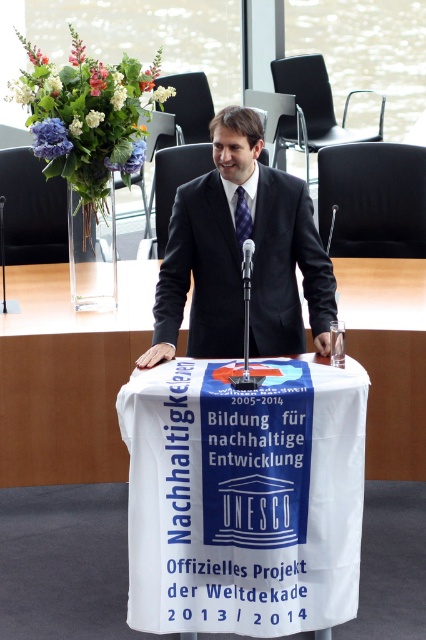
Question: Can you confirm if white cloth at center is wider than white cloth-covered table at center?

Choices:
 (A) yes
 (B) no

Answer: (B)

Question: Which object is the closest to the black plastic microphone at center?

Choices:
 (A) black suit at center
 (B) white cloth at center

Answer: (A)

Question: Based on their relative distances, which object is farther from the blue checkered tie at center?

Choices:
 (A) black suit at center
 (B) metallic silver microphone at center

Answer: (B)

Question: Does white cloth-covered table at center have a smaller size compared to blue checkered tie at center?

Choices:
 (A) no
 (B) yes

Answer: (A)

Question: Which of the following is the farthest from the observer?

Choices:
 (A) black suit at center
 (B) white cloth at center
 (C) metallic silver microphone at center
 (D) black plastic microphone at center

Answer: (D)

Question: Can you confirm if black suit at center is positioned above blue checkered tie at center?

Choices:
 (A) yes
 (B) no

Answer: (B)